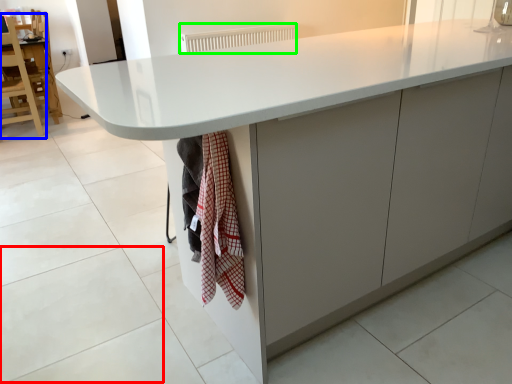
Question: Estimate the real-world distances between objects in this image. Which object is farther from granite (highlighted by a red box), chair (highlighted by a blue box) or radiator (highlighted by a green box)?

Choices:
 (A) chair
 (B) radiator

Answer: (B)